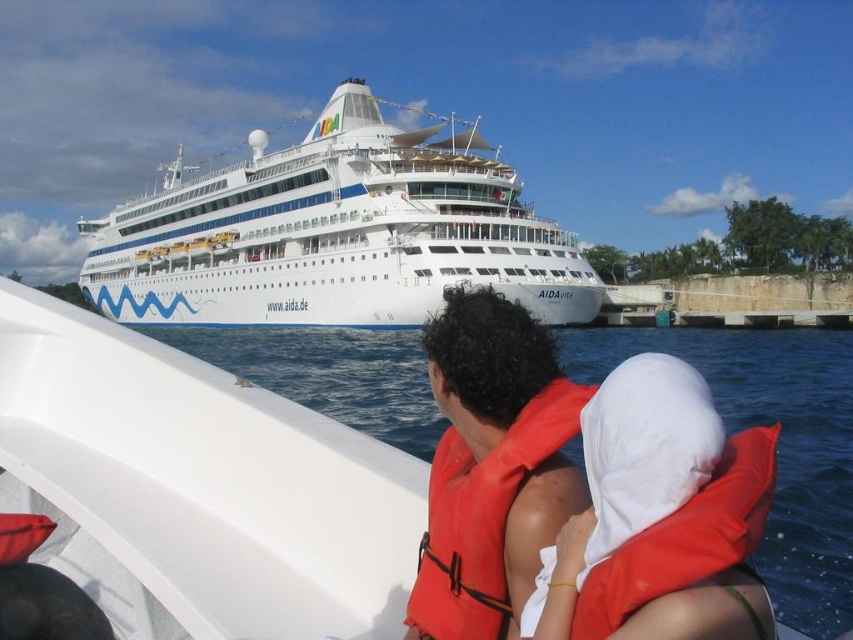
Question: Estimate the real-world distances between objects in this image. Which object is closer to the orange life jacket at center?

Choices:
 (A) white plastic boat at center
 (B) white glossy cruise ship at upper center
 (C) orange fabric life jacket at center
 (D) orange life vest at center

Answer: (D)

Question: Can you confirm if white plastic boat at center is wider than orange fabric life jacket at center?

Choices:
 (A) yes
 (B) no

Answer: (A)

Question: Does orange life vest at center have a greater width compared to orange fabric life jacket at center?

Choices:
 (A) no
 (B) yes

Answer: (B)

Question: Does white plastic boat at center appear on the left side of orange life vest at center?

Choices:
 (A) yes
 (B) no

Answer: (A)

Question: Which of the following is the farthest from the observer?

Choices:
 (A) white glossy cruise ship at upper center
 (B) orange life jacket at center
 (C) orange life vest at center

Answer: (A)

Question: Which of these objects is positioned closest to the orange life vest at center?

Choices:
 (A) white plastic boat at center
 (B) white glossy cruise ship at upper center
 (C) orange fabric life jacket at center

Answer: (C)